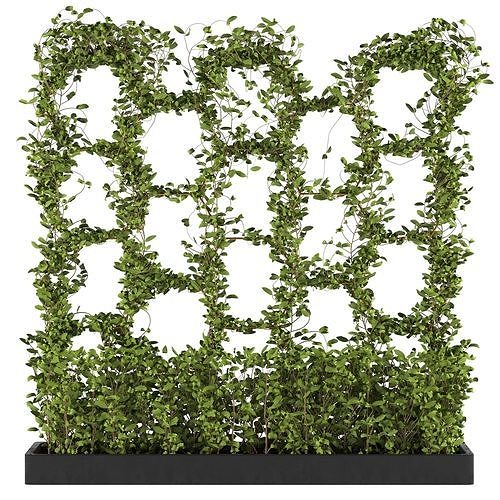
Where is `right corner of planter box`? right corner of planter box is located at coordinates (x=474, y=457).